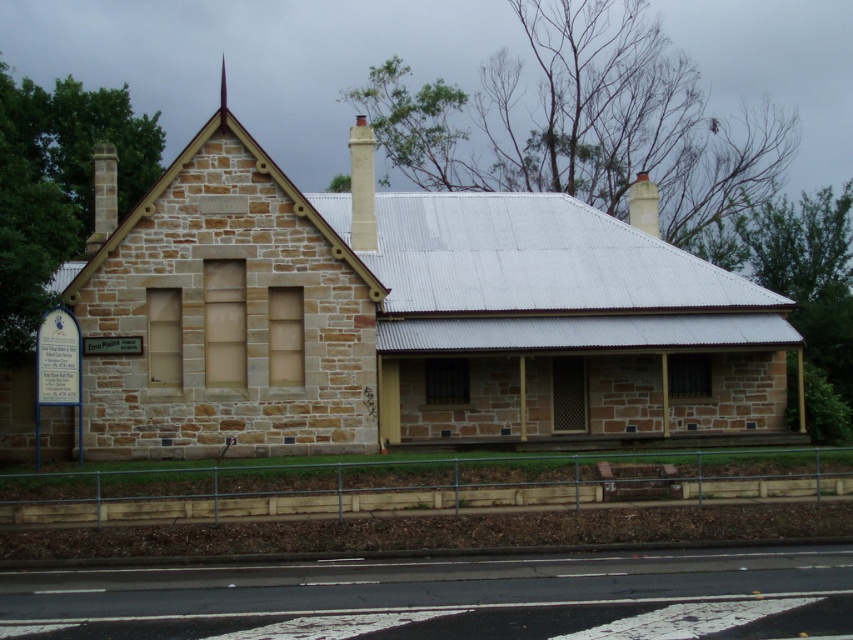
Between white stone chimney at center and white stone chimney at upper center, which one appears on the left side from the viewer's perspective?

From the viewer's perspective, white stone chimney at center appears more on the left side.

What do you see at coordinates (363, 186) in the screenshot? The image size is (853, 640). I see `white stone chimney at center` at bounding box center [363, 186].

Where is `white stone chimney at center`? white stone chimney at center is located at coordinates (363, 186).

Where is `white stone chimney at center`? Image resolution: width=853 pixels, height=640 pixels. white stone chimney at center is located at coordinates (363, 186).

Does brown stone church at center appear on the left side of white stone chimney at upper center?

Correct, you'll find brown stone church at center to the left of white stone chimney at upper center.

Describe the element at coordinates (402, 321) in the screenshot. I see `brown stone church at center` at that location.

Identify the location of brown stone church at center. (402, 321).

The width and height of the screenshot is (853, 640). In order to click on brown stone church at center in this screenshot , I will do `click(402, 321)`.

Is brown stone church at center bigger than white stone chimney at center?

Indeed, brown stone church at center has a larger size compared to white stone chimney at center.

Image resolution: width=853 pixels, height=640 pixels. Describe the element at coordinates (402, 321) in the screenshot. I see `brown stone church at center` at that location.

This screenshot has height=640, width=853. I want to click on brown stone church at center, so click(x=402, y=321).